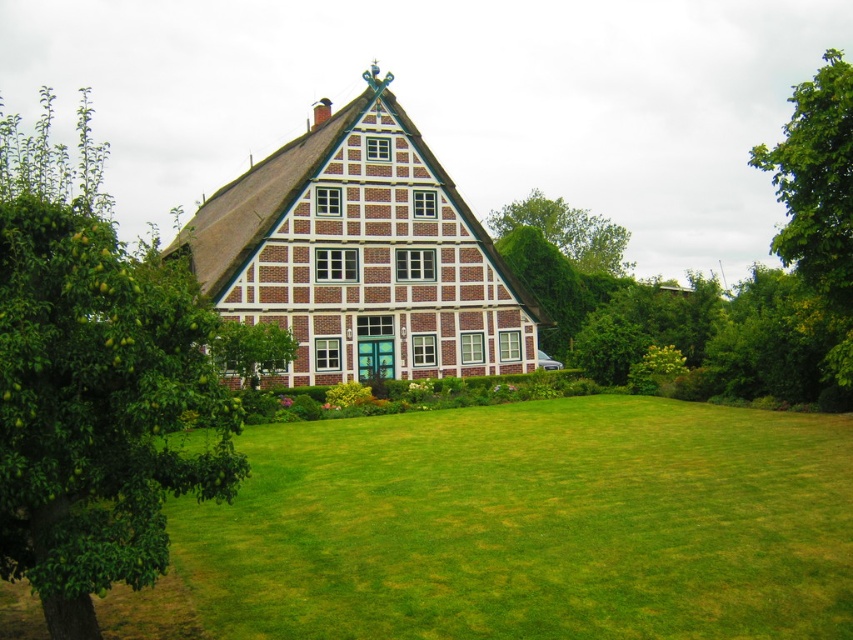
Question: Which point is farther from the camera taking this photo?

Choices:
 (A) (843, 355)
 (B) (604, 244)
 (C) (192, 486)
 (D) (276, 371)

Answer: (B)

Question: Can you confirm if green leafy tree at upper center is bigger than green leafy tree at center?

Choices:
 (A) no
 (B) yes

Answer: (B)

Question: Does green leafy tree at left have a smaller size compared to brick house at center?

Choices:
 (A) yes
 (B) no

Answer: (B)

Question: Which object is the closest to the brick house at center?

Choices:
 (A) green leafy tree at left
 (B) green leafy tree at center

Answer: (B)

Question: Which object is the farthest from the brick house at center?

Choices:
 (A) green leafy tree at left
 (B) green leafy tree at upper center

Answer: (B)

Question: Is green leafy tree at left bigger than brick house at center?

Choices:
 (A) no
 (B) yes

Answer: (B)